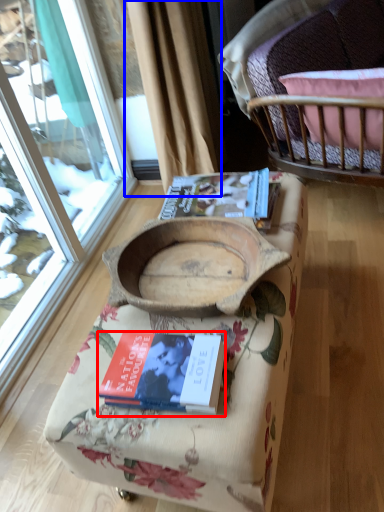
Question: Which of the following is the closest to the observer, book (highlighted by a red box) or curtain (highlighted by a blue box)?

Choices:
 (A) book
 (B) curtain

Answer: (A)